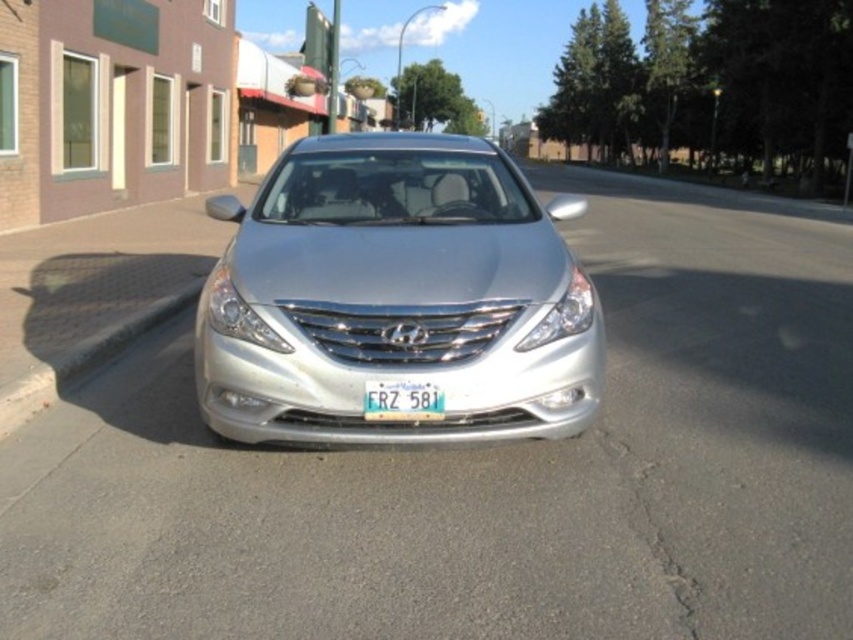
Question: Which point is farther from the camera taking this photo?

Choices:
 (A) (x=384, y=364)
 (B) (x=393, y=413)
 (C) (x=114, y=352)

Answer: (C)

Question: Does silver metallic sedan at center appear under white plastic license plate at center?

Choices:
 (A) no
 (B) yes

Answer: (A)

Question: Among these objects, which one is farthest from the camera?

Choices:
 (A) white plastic license plate at center
 (B) silver metallic sedan at center

Answer: (B)

Question: Which object appears farthest from the camera in this image?

Choices:
 (A) silver metallic sedan at center
 (B) black asphalt curb at lower left
 (C) white plastic license plate at center

Answer: (A)

Question: Does black asphalt curb at lower left have a larger size compared to white plastic license plate at center?

Choices:
 (A) yes
 (B) no

Answer: (A)

Question: Is black asphalt curb at lower left smaller than white plastic license plate at center?

Choices:
 (A) no
 (B) yes

Answer: (A)